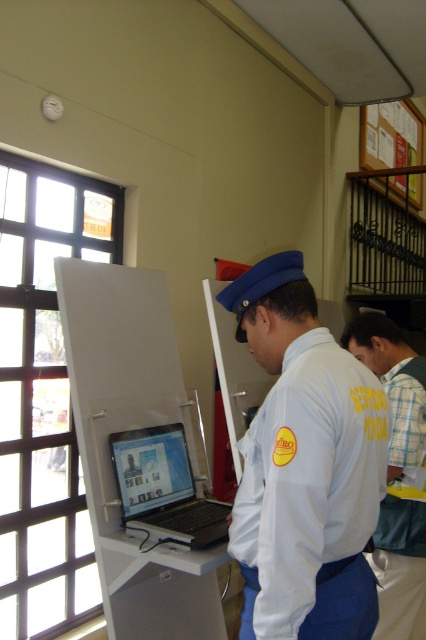
You are a photographer standing 2 meters away from the yellow fabric shirt at upper right. Can you take a clear photo of the camera without moving closer?

The yellow fabric shirt at upper right and camera are 1.98 meters apart from each other. Since you are standing 2 meters away from the yellow fabric shirt at upper right, the camera is approximately 0.02 meters away from your position. Therefore, you can take a clear photo of the camera without moving closer.

You are standing in front of the kiosk with the laptop. There is a point marked at coordinates point (351, 550). Can you reach this point without moving your position? Assume your outstretched hand can reach up to 1.3 meters.

The point (351, 550) is 1.27 meters away from the viewer. Since your outstretched hand can reach up to 1.3 meters, you can reach it without moving your position.